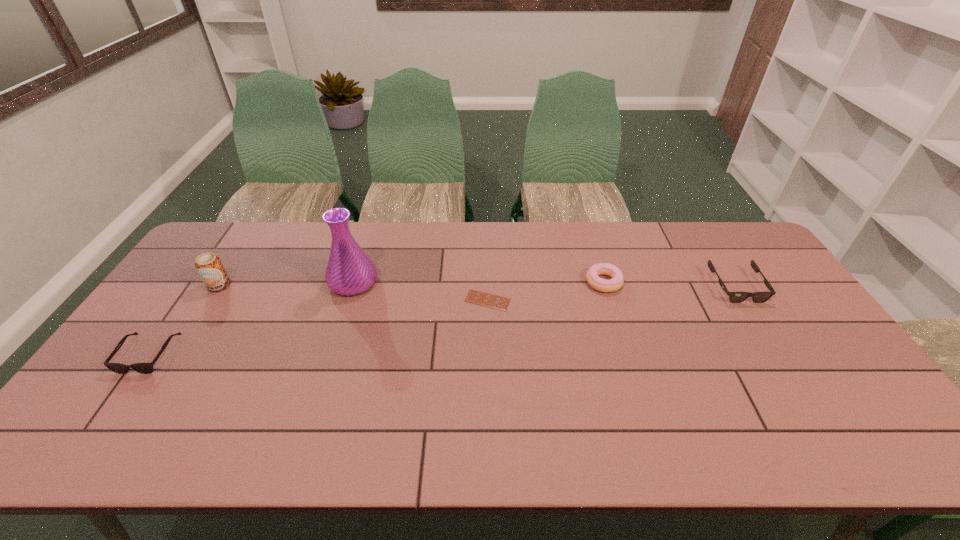
In order to click on free space located 0.080m on the front of the tallest object in this screenshot , I will do `click(342, 319)`.

Find the location of a particular element. vacant space located on the front of the beer can is located at coordinates coord(153,390).

Image resolution: width=960 pixels, height=540 pixels. I want to click on vacant space located 0.190m on the back of the fifth object from left to right, so click(589, 235).

The height and width of the screenshot is (540, 960). I want to click on vacant position located on the temples of the rightmost object, so click(770, 341).

You are a GUI agent. You are given a task and a screenshot of the screen. Output one action in this format:
    pyautogui.click(x=<x>, y=<y>)
    Task: Click on the free spot located 0.070m at the front lenses of the nearer sunglasses
    
    Given the screenshot: What is the action you would take?
    pyautogui.click(x=118, y=398)

Identify the location of vacant space located on the right of the fourth object from left to right. tap(603, 300).

Identify the location of beer can present at the left edge. Image resolution: width=960 pixels, height=540 pixels. (209, 266).

Where is `sunglasses present at the left edge`? This screenshot has width=960, height=540. sunglasses present at the left edge is located at coordinates (144, 368).

Find the location of a particular element. The width and height of the screenshot is (960, 540). object positioned at the right edge is located at coordinates (735, 297).

In the image, there is a desktop. Find the location of `free space at the far edge`. free space at the far edge is located at coordinates (453, 222).